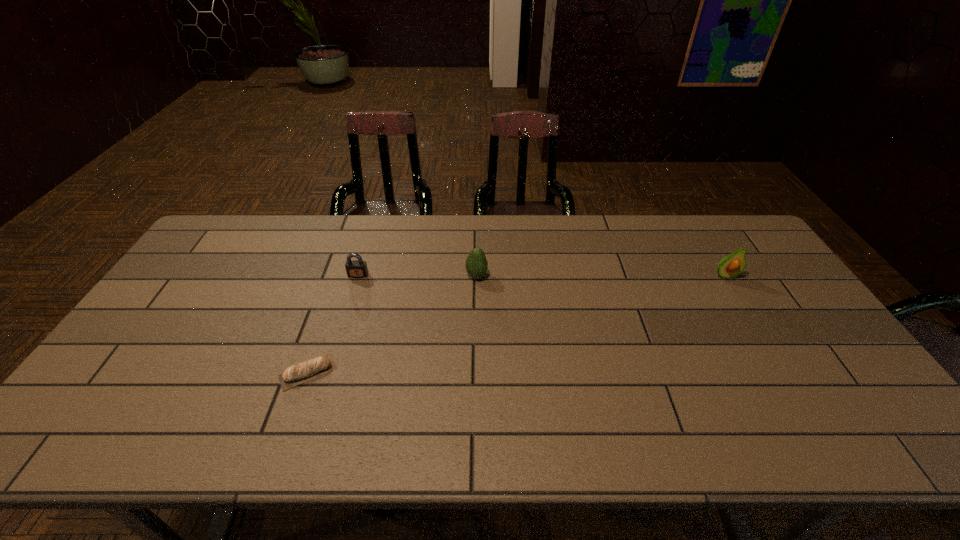
The image size is (960, 540). Identify the location of free region at the far edge of the desktop. (532, 215).

Locate an element on the screen. This screenshot has width=960, height=540. free space at the near edge of the desktop is located at coordinates (246, 443).

In the image, there is a desktop. At what (x,y) coordinates should I click in order to perform the action: click on blank space at the left edge. Please return your answer as a coordinate pair (x, y). The image size is (960, 540). Looking at the image, I should click on (180, 285).

Locate an element on the screen. vacant space at the far left corner of the desktop is located at coordinates (238, 225).

At what (x,y) coordinates should I click in order to perform the action: click on empty space that is in between the nearest object and the padlock. Please return your answer as a coordinate pair (x, y). Looking at the image, I should click on 333,323.

The image size is (960, 540). What are the coordinates of `unoccupied position between the second shortest object and the rightmost object` in the screenshot? It's located at (541, 275).

In order to click on empty space that is in between the rightmost object and the shortest object in this screenshot , I will do `click(516, 324)`.

This screenshot has height=540, width=960. What are the coordinates of `empty space that is in between the second object from right to left and the third tallest object` in the screenshot? It's located at (418, 275).

This screenshot has width=960, height=540. I want to click on vacant area between the rightmost object and the pita bread, so click(x=516, y=324).

Where is `free area in between the right avocado and the third tallest object`? The width and height of the screenshot is (960, 540). free area in between the right avocado and the third tallest object is located at coordinates (541, 275).